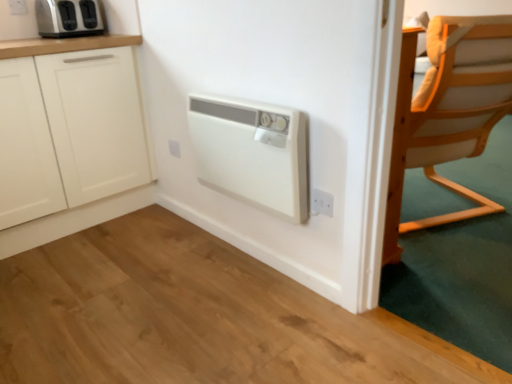
The width and height of the screenshot is (512, 384). Find the location of `vacant space underneath white plastic heater at center (from a real-world perspective)`. vacant space underneath white plastic heater at center (from a real-world perspective) is located at coordinates (256, 261).